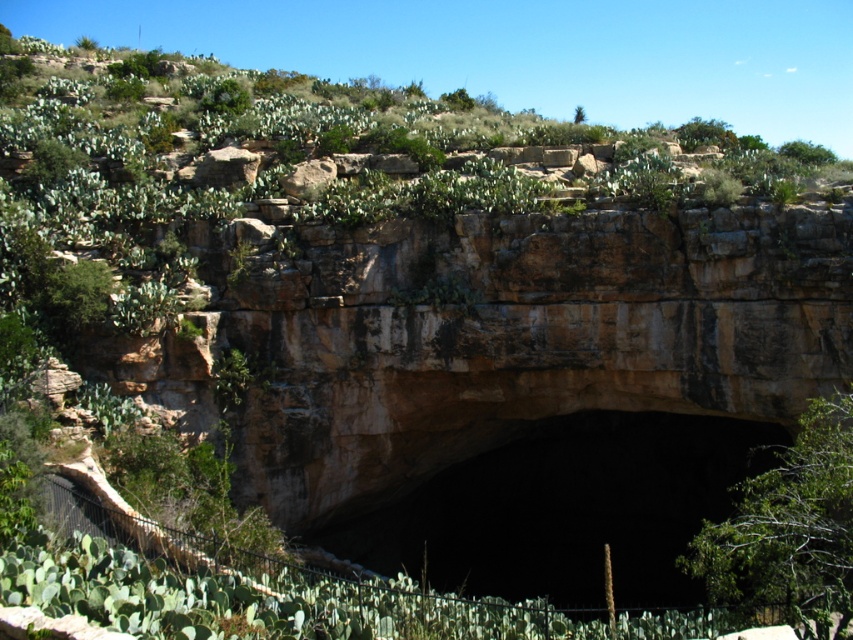
You are a hiker standing at the base of the cliff and want to reach the green leafy bush at center. Which direction should you move relative to the dark brown stone cave at center?

You should move to the right of the dark brown stone cave at center to reach the green leafy bush at center because the cave is to the left of the bush.

You are standing at the base of the cliff and see the point marked at coordinates (x=567, y=509). Based on the scene description, what object does this point most likely represent?

The point at coordinates (x=567, y=509) most likely represents the dark brown stone cave at center, as it is located at the base of the cliff where the cave opening is described.

You are an explorer standing at the base of the cliff and want to take a photo of both the dark brown stone cave at center and the green leafy bush at center. Which object should you focus on first if you want to capture both in a single frame without moving your camera?

You should focus on the dark brown stone cave at center first because it is smaller than the green leafy bush at center, so you can adjust your camera to include both in the frame by centering the smaller object first.